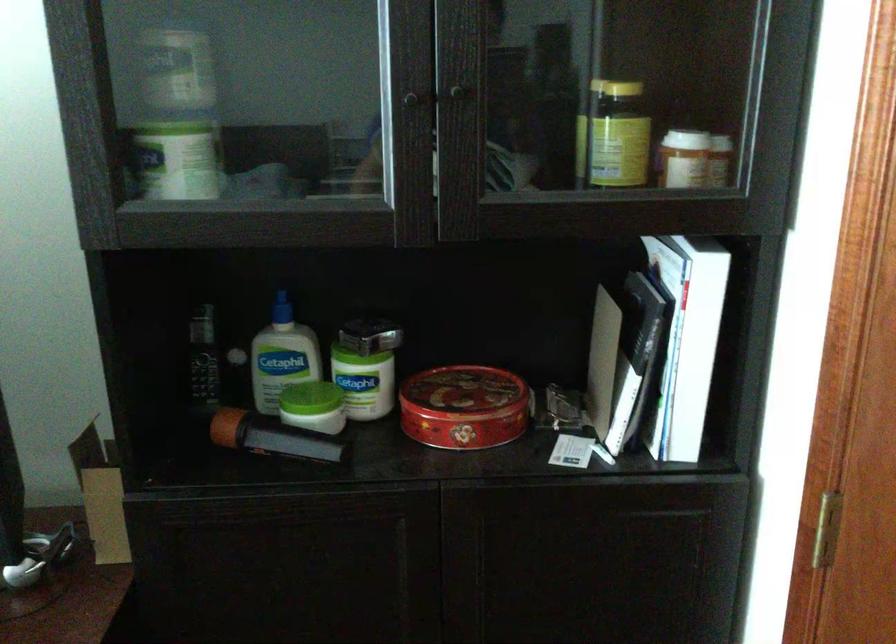
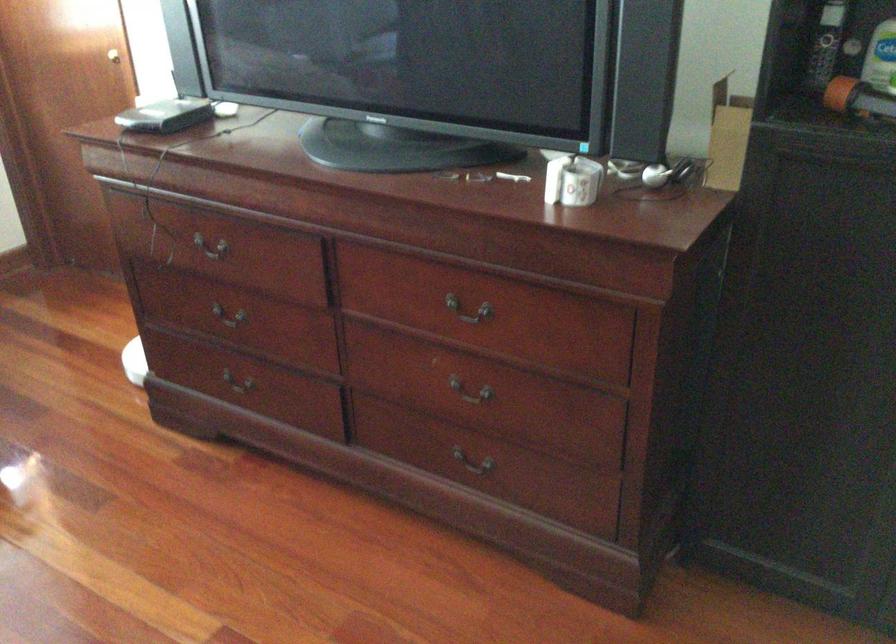
In the second image, find the point that corresponds to (x=273, y=388) in the first image.

(883, 77)